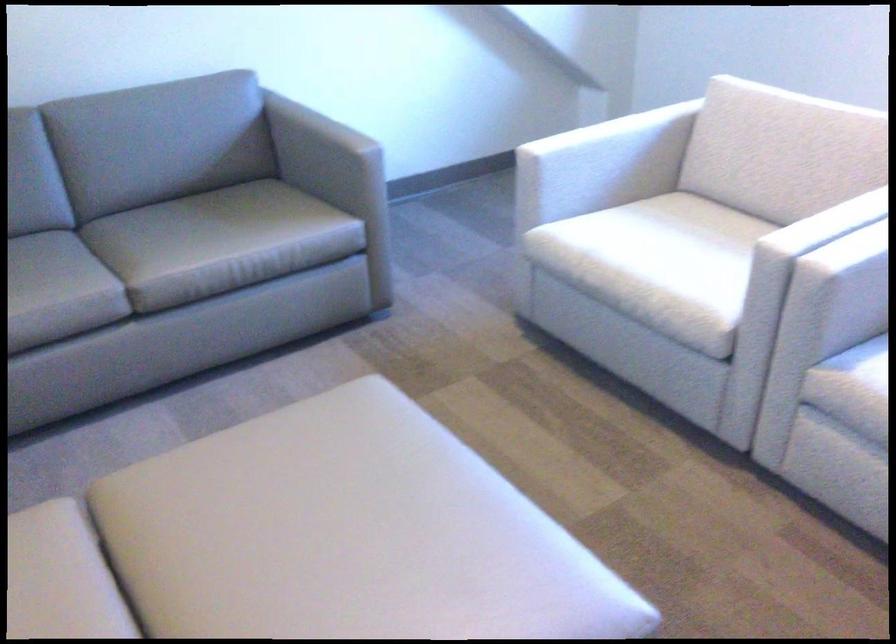
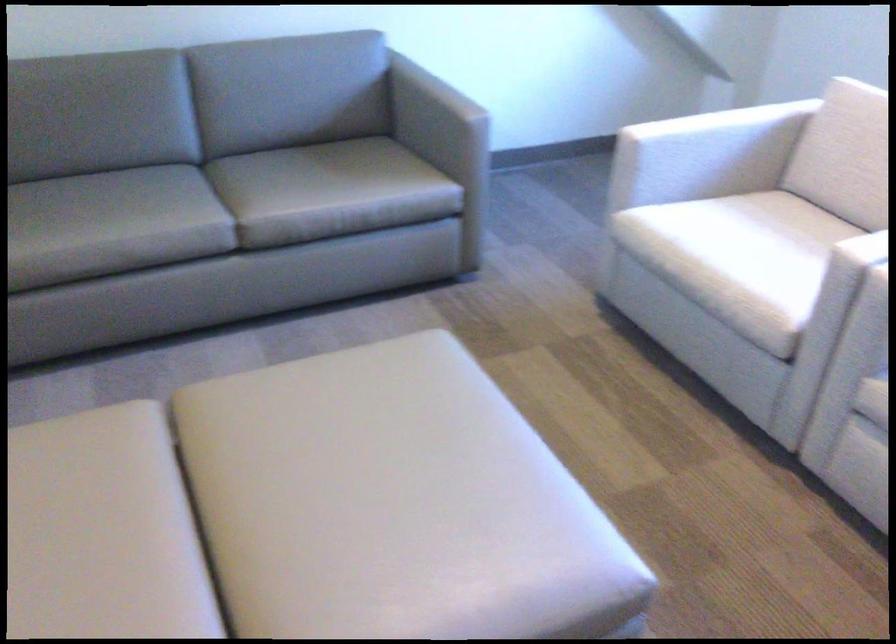
Locate, in the second image, the point that corresponds to [659,265] in the first image.

(737, 261)